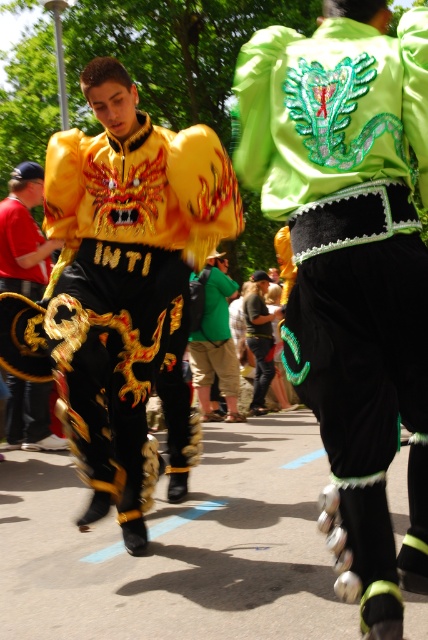
Consider the image. You are a photographer standing in front of the two individuals in the scene. You want to take a photo that includes both the point at location [231,166] and the point at [8,253]. Which point is closer to you so that you can focus on it first?

Point [231,166] is closer to the viewer than point [8,253], so you should focus on point [231,166] first.

You are a photographer at the event and want to capture a photo where both the green sequined dragon at center and the gold embroidered jacket at center are clearly visible. Based on their positions, which one should you focus on first to ensure proper focus?

The green sequined dragon at center is above the gold embroidered jacket at center, so you should focus on the green sequined dragon at center first to ensure proper focus.